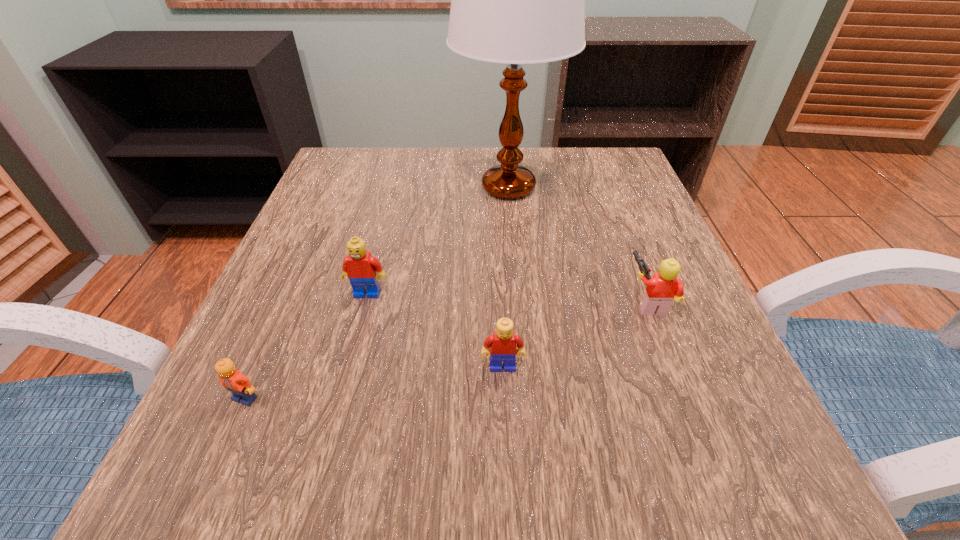
At what (x,y) coordinates should I click in order to perform the action: click on vacant space at the right edge. Please return your answer as a coordinate pair (x, y). The height and width of the screenshot is (540, 960). Looking at the image, I should click on (659, 221).

Image resolution: width=960 pixels, height=540 pixels. Identify the location of vacant space at the far left corner. (314, 194).

The width and height of the screenshot is (960, 540). In the image, there is a desktop. What are the coordinates of `free space at the far right corner` in the screenshot? It's located at (586, 157).

This screenshot has height=540, width=960. In the image, there is a desktop. Find the location of `vacant space at the near right corner`. vacant space at the near right corner is located at coordinates (709, 513).

Locate an element on the screen. The image size is (960, 540). vacant point located between the farthest object and the third Lego from right to left is located at coordinates (438, 240).

In order to click on unoccupied position between the fourth object from right to left and the second nearest object in this screenshot , I will do `click(435, 330)`.

You are a GUI agent. You are given a task and a screenshot of the screen. Output one action in this format:
    pyautogui.click(x=<x>, y=<y>)
    Task: Click on the free space between the nearest Lego and the rightmost Lego
    
    Given the screenshot: What is the action you would take?
    click(x=447, y=350)

Find the location of `free area in between the nearest object and the second Lego from left to right`. free area in between the nearest object and the second Lego from left to right is located at coordinates (306, 346).

At what (x,y) coordinates should I click in order to perform the action: click on free space between the tallest object and the fourth farthest object. Please return your answer as a coordinate pair (x, y). Looking at the image, I should click on (506, 277).

Locate an element on the screen. free space that is in between the rightmost object and the second object from left to right is located at coordinates (508, 298).